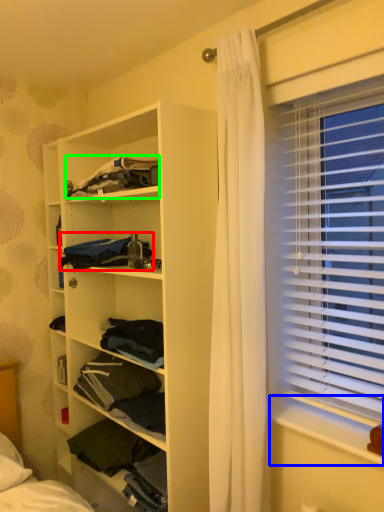
Question: Which object is positioned farthest from clothing (highlighted by a red box)? Select from window sill (highlighted by a blue box) and clothing (highlighted by a green box).

Choices:
 (A) window sill
 (B) clothing

Answer: (A)